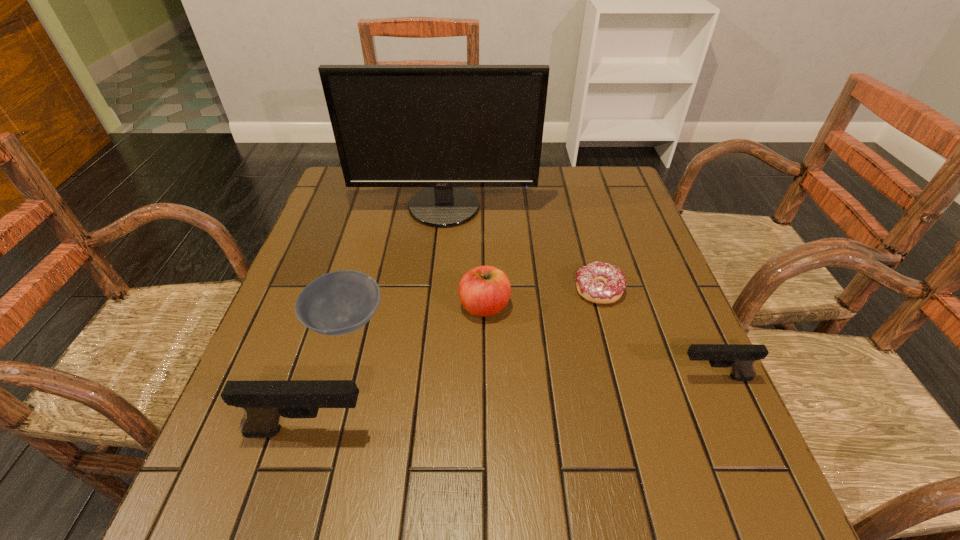
Identify the location of free space between the second tallest object and the apple. (396, 369).

In order to click on free point between the bowl and the tallest object in this screenshot , I will do `click(395, 264)`.

Select which object is the fourth closest to the doughnut. Please provide its 2D coordinates. Your answer should be formatted as a tuple, i.e. [(x, y)], where the tuple contains the x and y coordinates of a point satisfying the conditions above.

[(337, 303)]

Locate which object ranks in proximity to the left pistol. Please provide its 2D coordinates. Your answer should be formatted as a tuple, i.e. [(x, y)], where the tuple contains the x and y coordinates of a point satisfying the conditions above.

[(337, 303)]

Find the location of a particular element. free location that satisfies the following two spatial constraints: 1. on the screen side of the tallest object; 2. on the front-facing side of the left pistol is located at coordinates (421, 431).

Identify the location of vacant region that satisfies the following two spatial constraints: 1. on the screen side of the tallest object; 2. on the front-facing side of the second tallest object. The width and height of the screenshot is (960, 540). (421, 431).

Locate an element on the screen. This screenshot has height=540, width=960. vacant space that satisfies the following two spatial constraints: 1. on the back side of the apple; 2. on the right side of the doughnut is located at coordinates coord(485,290).

The image size is (960, 540). In order to click on free space that satisfies the following two spatial constraints: 1. on the screen side of the tallest object; 2. on the front-facing side of the second tallest object in this screenshot , I will do `click(421, 431)`.

I want to click on blank space that satisfies the following two spatial constraints: 1. on the back side of the apple; 2. on the right side of the fifth tallest object, so click(x=349, y=306).